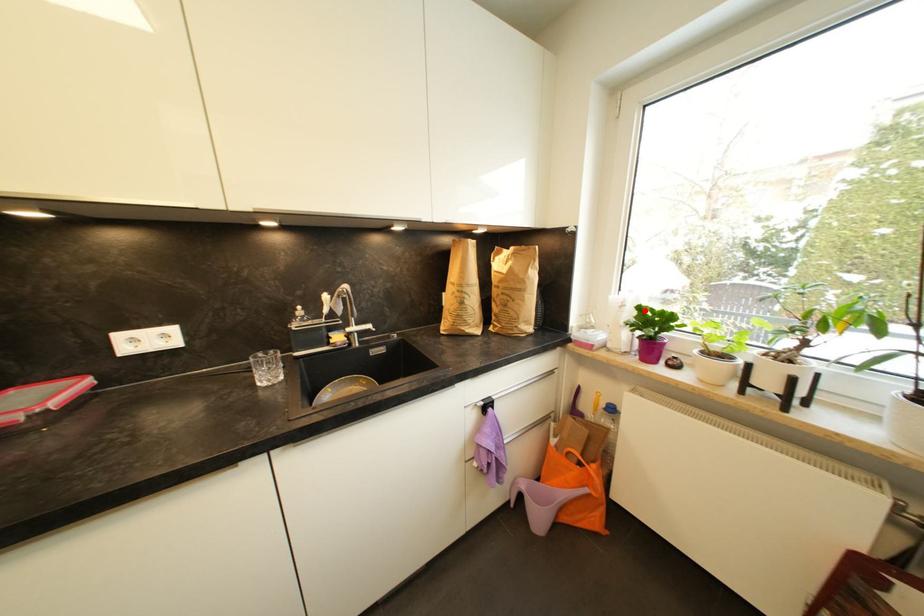
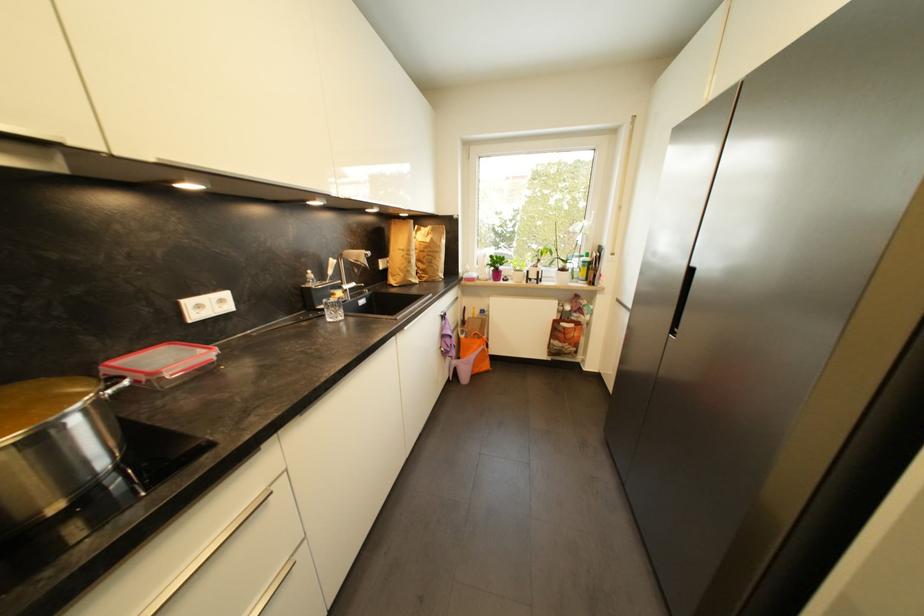
In the second image, find the point that corresponds to the highlighted location in the first image.

(495, 257)